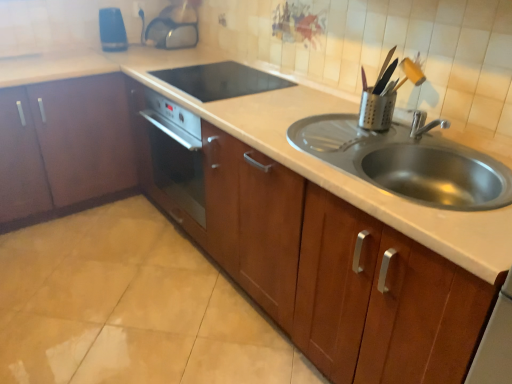
Identify the location of vacant region to the left of metallic silver utensil holder at upper right, the fourth appliance in the back-to-front sequence. The image size is (512, 384). (337, 124).